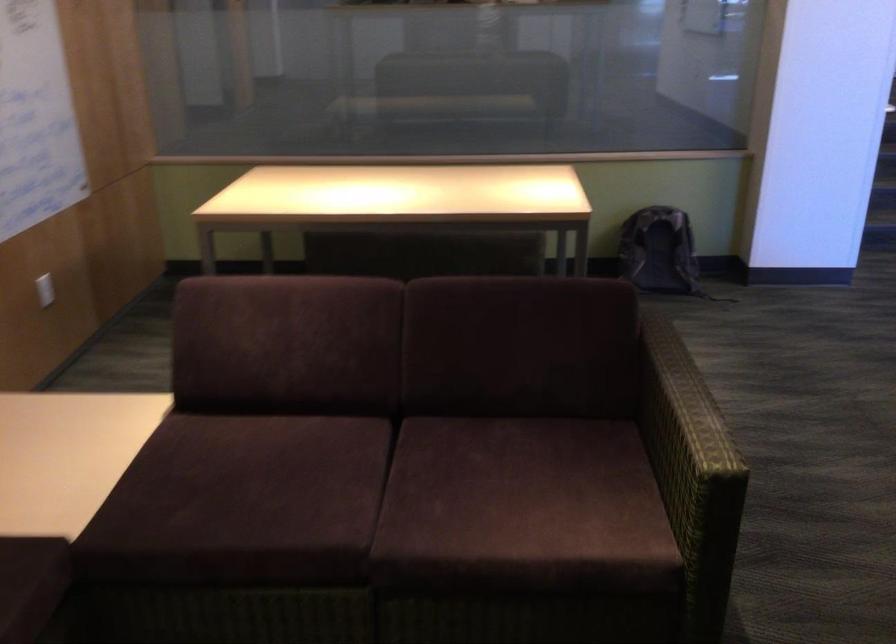
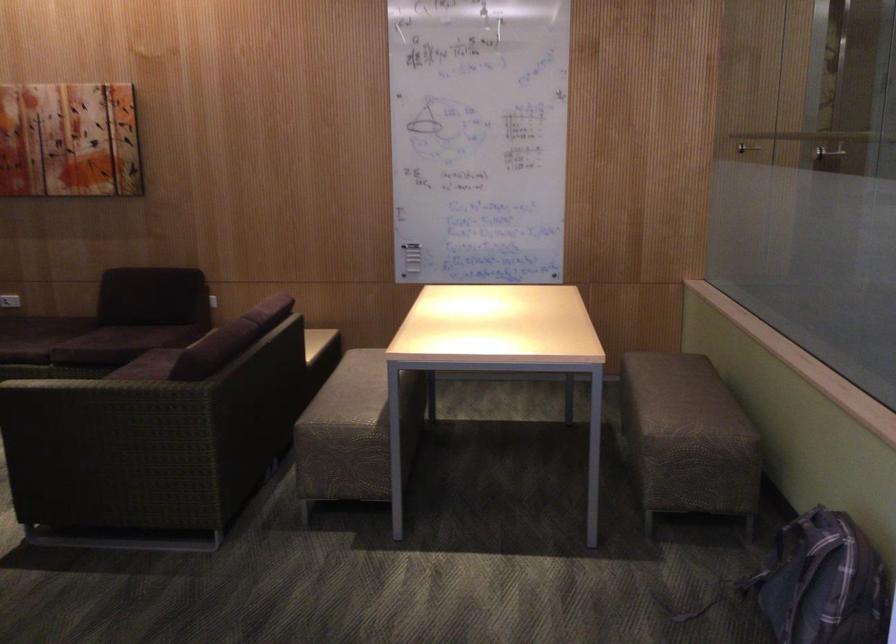
Question: I am providing you with two images of the same scene from different viewpoints. Which of the following objects are not visible in image2?

Choices:
 (A) tall silver shaker
 (B) white light switch
 (C) white power outlet
 (D) metal partition handle

Answer: (B)